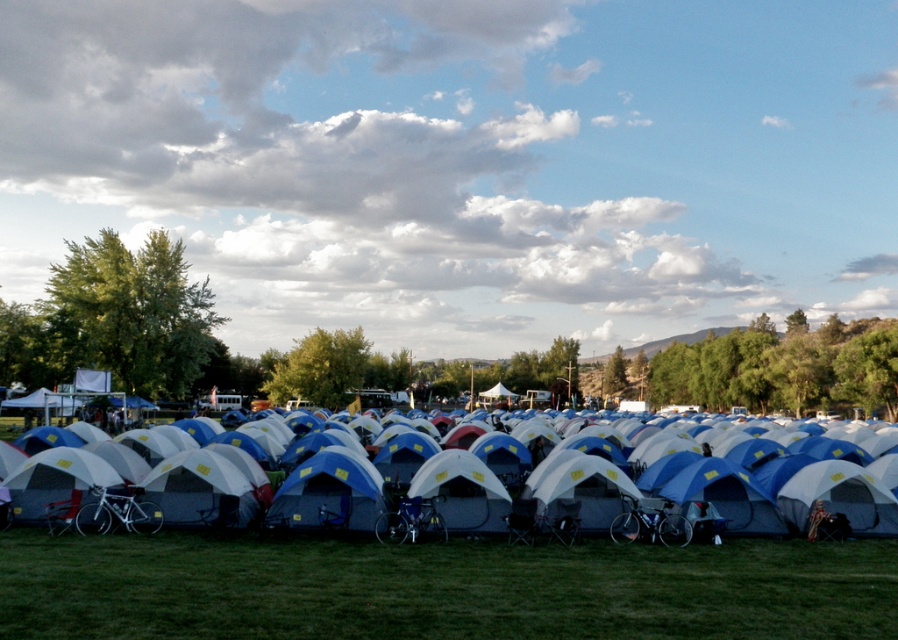
Question: Which point is farther to the camera?

Choices:
 (A) (793, 493)
 (B) (773, 550)

Answer: (A)

Question: Which point is farther to the camera?

Choices:
 (A) white fabric tent at center
 (B) green grass at lower center

Answer: (A)

Question: Does green grass at lower center have a larger size compared to white fabric tent at center?

Choices:
 (A) no
 (B) yes

Answer: (A)

Question: Does green grass at lower center have a smaller size compared to white fabric tent at center?

Choices:
 (A) no
 (B) yes

Answer: (B)

Question: From the image, what is the correct spatial relationship of green grass at lower center in relation to white fabric tent at center?

Choices:
 (A) below
 (B) above

Answer: (B)